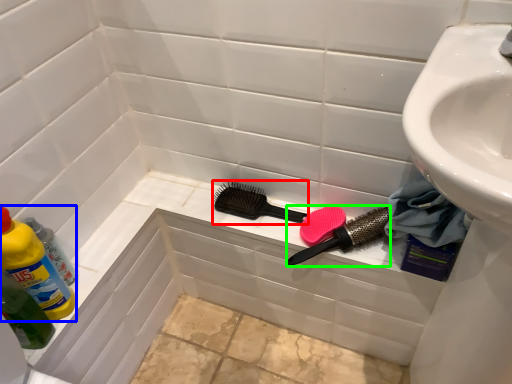
Question: Which object is the farthest from brush (highlighted by a red box)? Choose among these: cleaning product (highlighted by a blue box) or brush (highlighted by a green box).

Choices:
 (A) cleaning product
 (B) brush

Answer: (A)